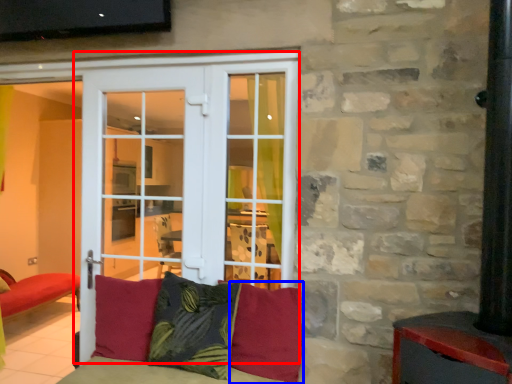
Question: Which of the following is the closest to the observer, door (highlighted by a red box) or pillow (highlighted by a blue box)?

Choices:
 (A) door
 (B) pillow

Answer: (B)